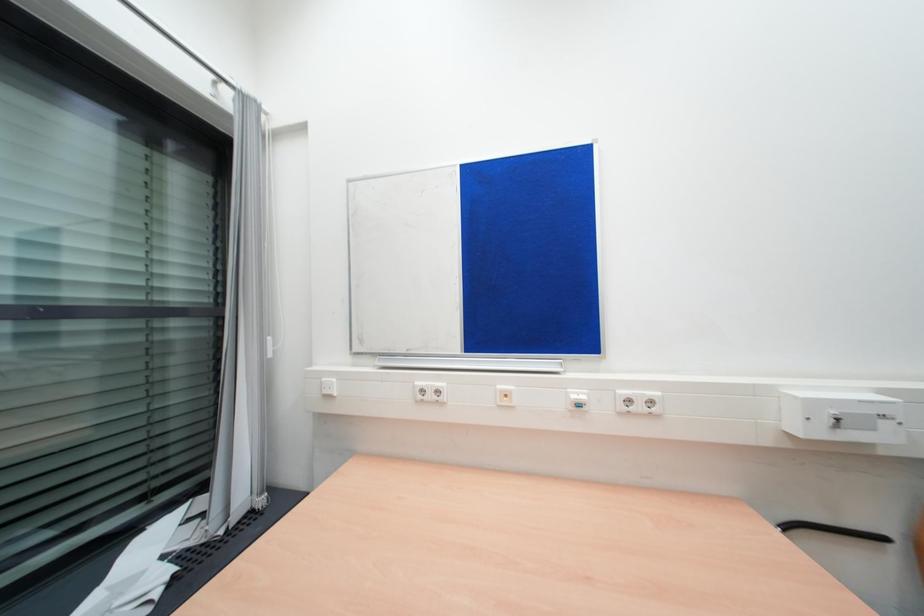
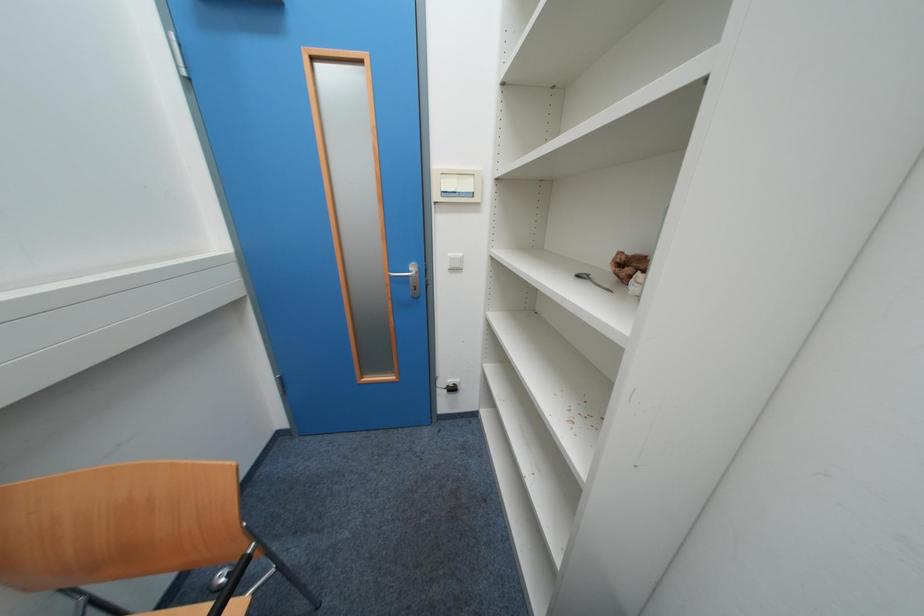
How did the camera likely rotate?

A: The rotation direction of the camera is right-down.